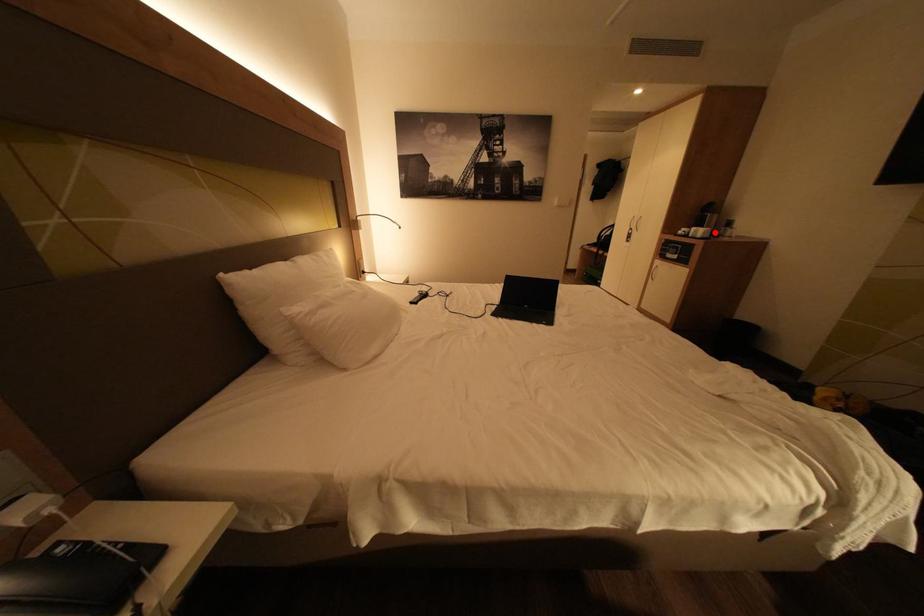
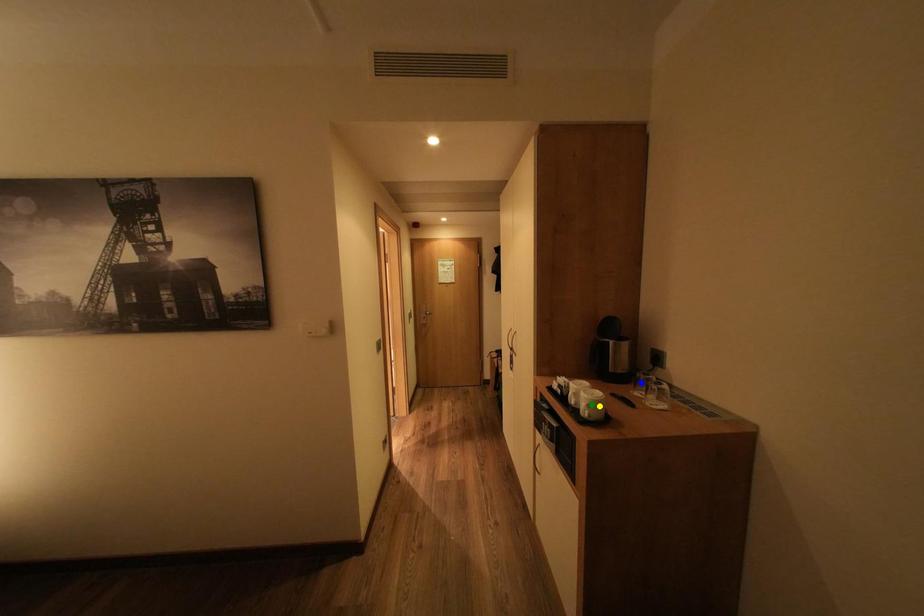
Question: I am providing you with two images of the same scene from different viewpoints. A red point is marked on the first image. You are given multiple points on the second image. Which point in image 2 represents the same 3d spot as the red point in image 1?

Choices:
 (A) green point
 (B) yellow point
 (C) blue point

Answer: (B)